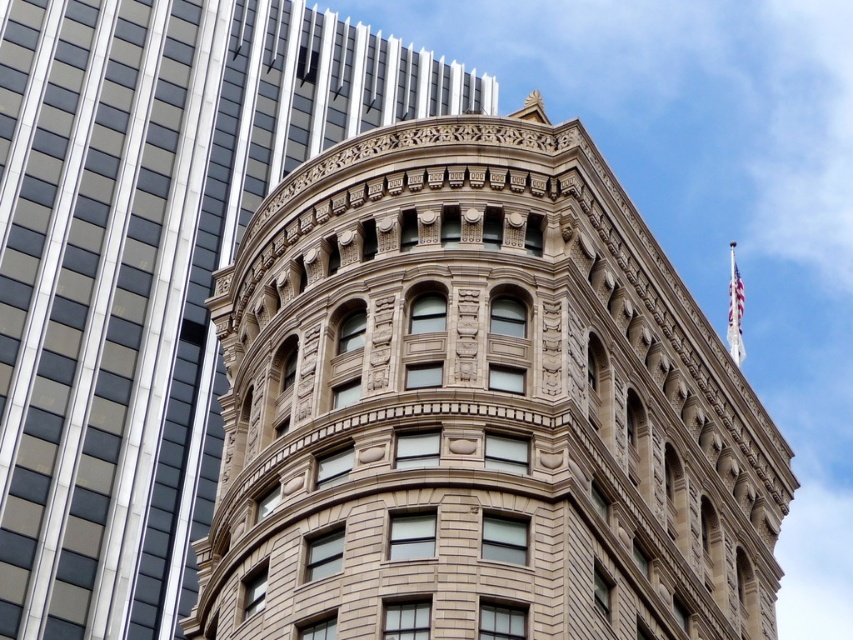
Where is `brown stone tower at center`? This screenshot has width=853, height=640. brown stone tower at center is located at coordinates [x=479, y=408].

Is point (526, 161) positioned after point (485, 113)?

No, it is in front of (485, 113).

Is point (364, 224) positioned behind point (277, 72)?

No, (364, 224) is closer to viewer.

This screenshot has width=853, height=640. Find the location of `brown stone tower at center`. brown stone tower at center is located at coordinates (479, 408).